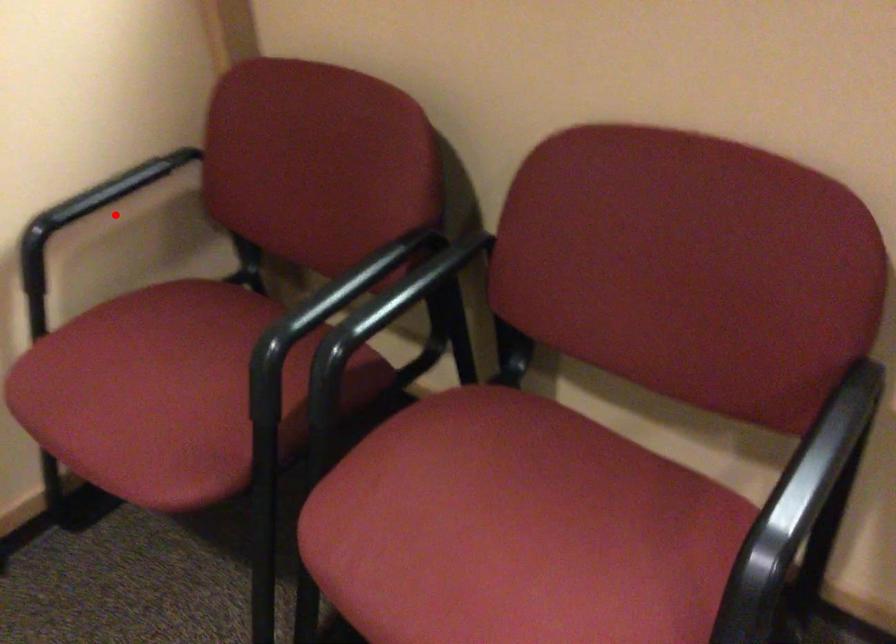
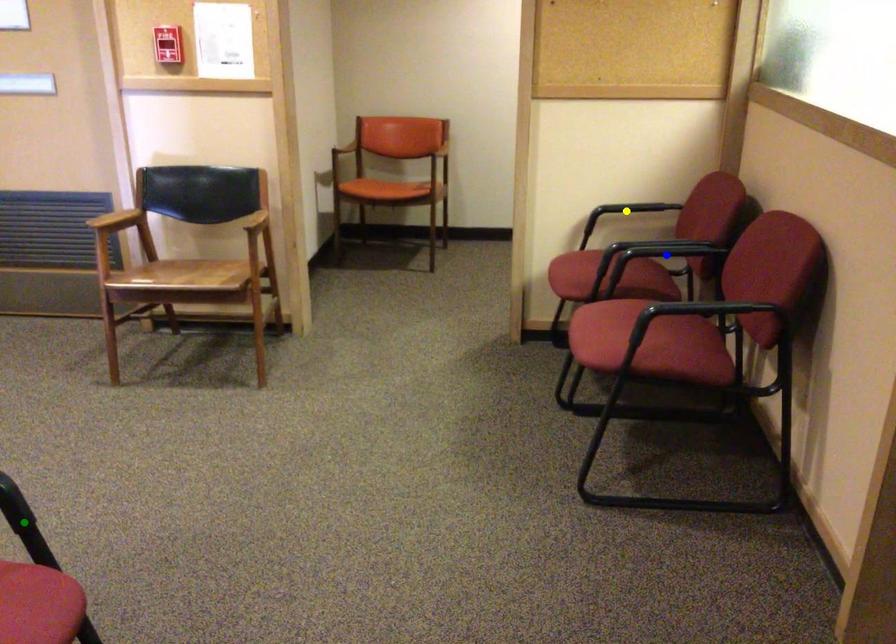
Question: I am providing you with two images of the same scene from different viewpoints. A red point is marked on the first image. You are given multiple points on the second image. Can you choose the point in image 2 that corresponds to the point in image 1?

Choices:
 (A) blue point
 (B) green point
 (C) yellow point

Answer: (C)